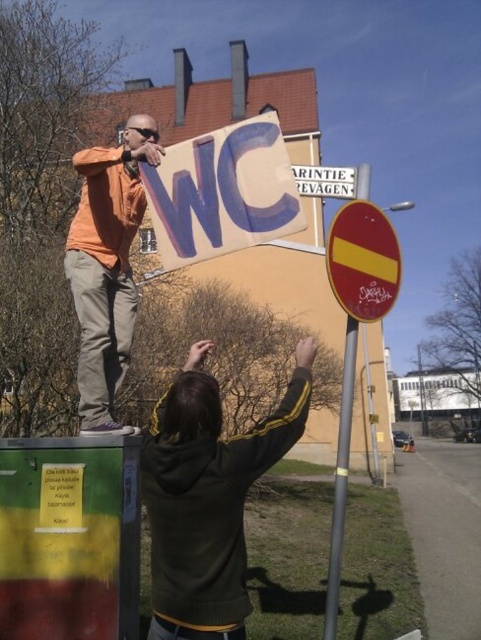
Looking at this image, you are a delivery person who needs to place a metallic reflective sign at center on a pole that is 1.2 meters wide. Can the sign fit on the pole without overlapping the edges?

The metallic reflective sign at center has dimensions that are not specified in the provided information. Without knowing its size, it is impossible to determine if it will fit on the 1.2 meter wide pole without overlapping the edges.

You are a pedestrian trying to read the white plastic sign at upper center. There is a metallic gray pole at center blocking your view. Can you move around the pole to see the sign clearly?

The metallic gray pole at center is in front of the white plastic sign at upper center, so moving around the pole could allow you to see the sign clearly.